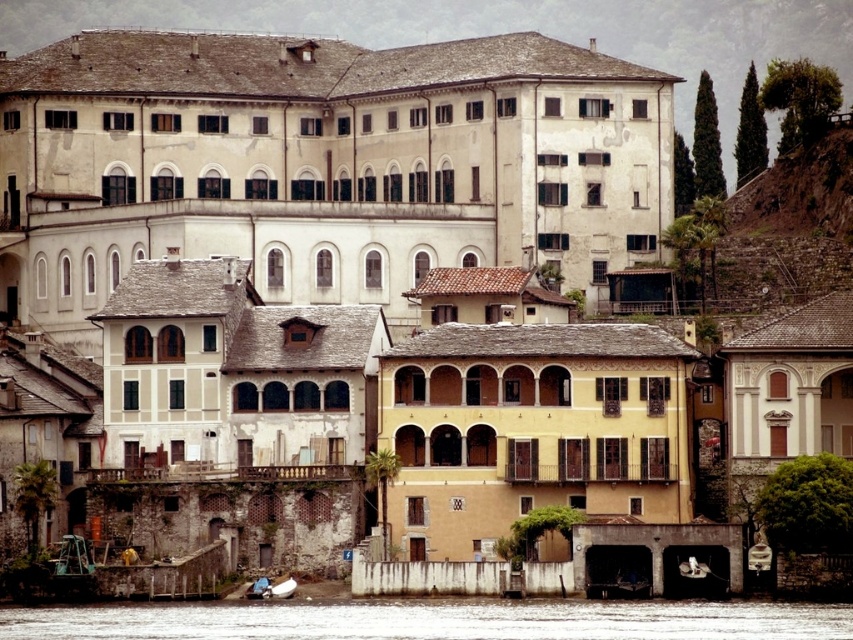
You are standing on the riverside path and see the clear water at lower center and the blue fabric boat at lower center. Which object is closer to you?

The clear water at lower center is closer to you because it is above the blue fabric boat at lower center, meaning the boat is submerged or positioned beneath the water surface.

You are standing at the riverside and want to cross the river using the blue fabric boat at lower center. The clear water at lower center is where the boat is located. Can you safely move the boat to the other side of the river?

The clear water at lower center might be wider than blue fabric boat at lower center, so it is uncertain if the boat can safely cross. The width of the water could exceed the boat length, making it risky without knowing exact measurements.